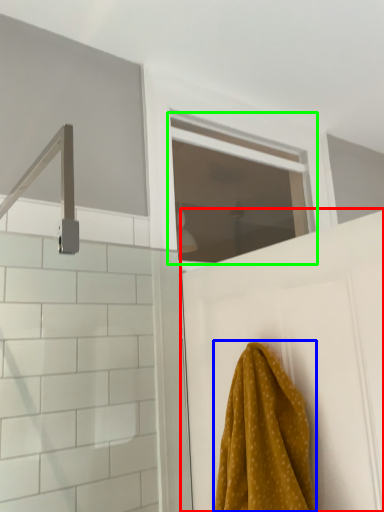
Question: Which object is positioned farthest from door (highlighted by a red box)? Select from towel (highlighted by a blue box) and window (highlighted by a green box).

Choices:
 (A) towel
 (B) window

Answer: (B)